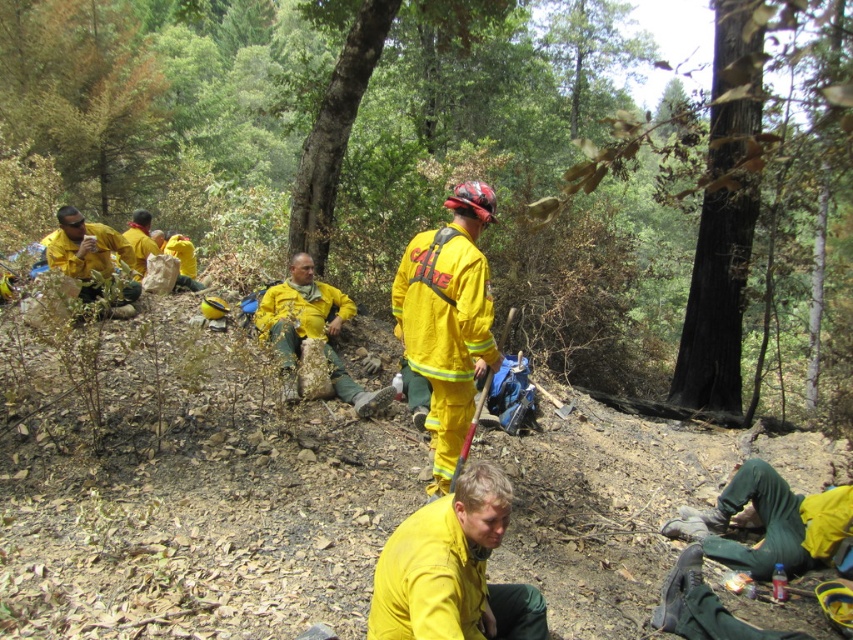
How far apart are yellow matte uniform at center and yellow reflective uniform at center?

yellow matte uniform at center is 1.76 meters from yellow reflective uniform at center.

This screenshot has width=853, height=640. Describe the element at coordinates (447, 321) in the screenshot. I see `yellow matte uniform at center` at that location.

Where is `yellow matte uniform at center`? The image size is (853, 640). yellow matte uniform at center is located at coordinates [447, 321].

Find the location of a particular element. Image resolution: width=853 pixels, height=640 pixels. yellow fabric uniform at center is located at coordinates (459, 160).

Is yellow fabric uniform at center closer to the viewer compared to yellow reflective uniform at center?

Yes, yellow fabric uniform at center is closer to the viewer.

Does point (277, 45) come in front of point (370, 403)?

No.

Locate an element on the screen. This screenshot has width=853, height=640. yellow fabric uniform at center is located at coordinates (459, 160).

Does yellow fabric uniform at center have a smaller size compared to matte yellow uniform at center?

Actually, yellow fabric uniform at center might be larger than matte yellow uniform at center.

Who is more distant from viewer, (659, 212) or (111, 248)?

Point (659, 212)

Describe the element at coordinates (459, 160) in the screenshot. I see `yellow fabric uniform at center` at that location.

The width and height of the screenshot is (853, 640). Find the location of `yellow fabric uniform at center`. yellow fabric uniform at center is located at coordinates (459, 160).